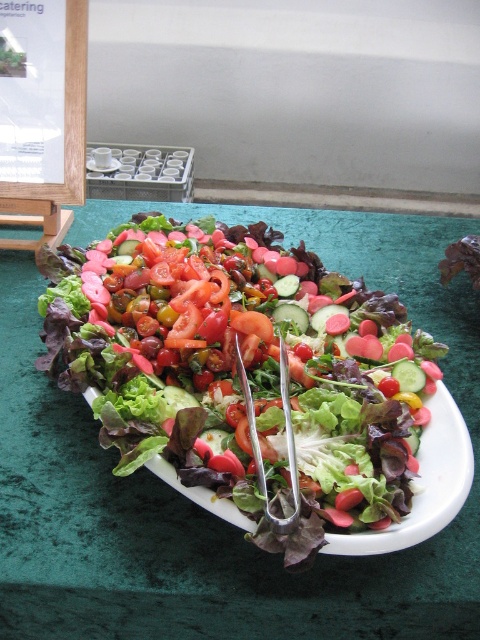
Which is more to the left, fresh green salad at center or white ceramic plate at center?

From the viewer's perspective, white ceramic plate at center appears more on the left side.

Can you confirm if fresh green salad at center is positioned above white ceramic plate at center?

No.

Is point (130, 321) less distant than point (113, 170)?

That is True.

Where is `fresh green salad at center`? fresh green salad at center is located at coordinates (240, 371).